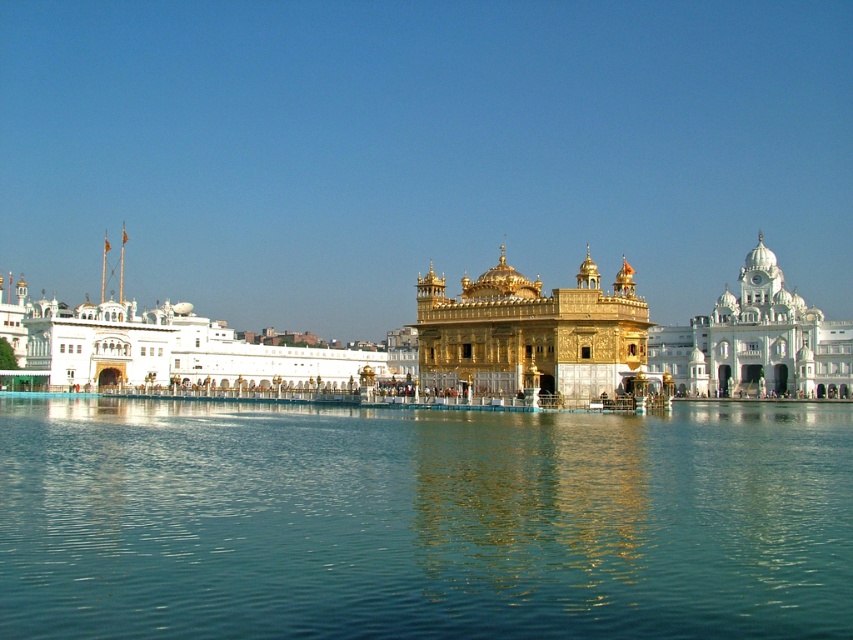
You are a tourist standing at the entrance of the Golden Temple and want to take a photo of the golden polished dome at center. Where should you position yourself to capture the dome in the center of your camera frame?

The golden polished dome at center is located at point coordinates of (532,333), so to capture it in the center of your camera frame, you should position yourself directly facing the temple at the entrance, ensuring the dome aligns with the center point of your viewfinder.

You are standing at the edge of the pool surrounding the Golden Temple and want to know the distance between you and the golden polished dome at center. Can you estimate how far you are from it?

The golden polished dome at center is 96.13 meters away from the viewer, so you are approximately 96.13 meters away from it.

You are a photographer planning to capture the Golden Temple in a wide shot. Given that the transparent blue water at center and the gold ornate palace at center are both in the frame, which one appears wider in the image?

The transparent blue water at center appears wider than the gold ornate palace at center in the image.